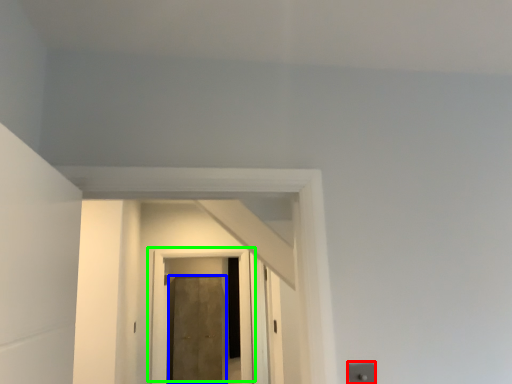
Question: Considering the real-world distances, which object is closest to electric outlet (highlighted by a red box)? door (highlighted by a blue box) or door (highlighted by a green box).

Choices:
 (A) door
 (B) door

Answer: (B)